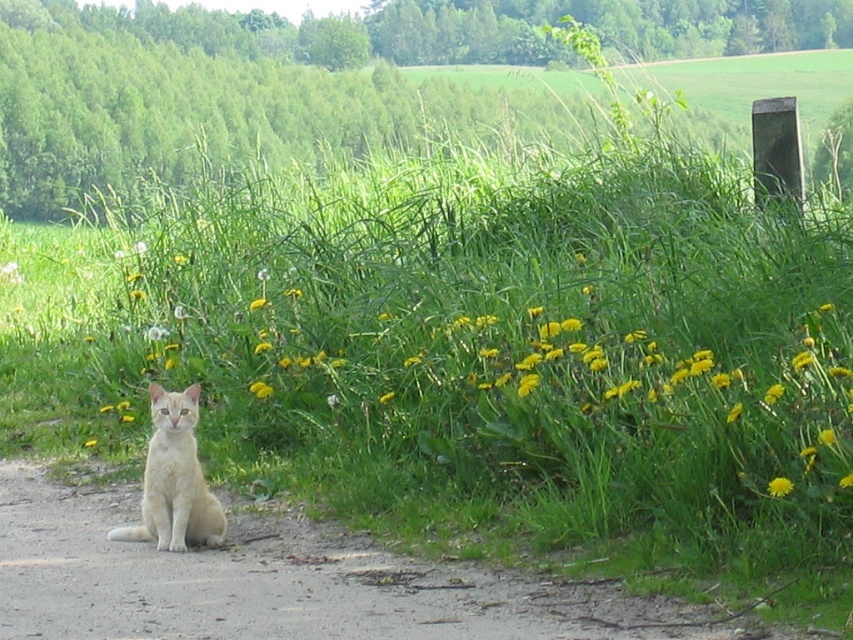
Based on the photo, between brown dirt track at lower left and light beige fur cat at lower left, which one has more height?

light beige fur cat at lower left

Is point (289, 611) behind point (167, 484)?

No, (289, 611) is in front of (167, 484).

Between point (146, 636) and point (194, 401), which one is positioned behind?

The point (194, 401) is behind.

This screenshot has width=853, height=640. I want to click on brown dirt track at lower left, so click(274, 582).

Does yellow matte flower at lower right have a lesser width compared to yellow matte flower at center?

Yes, yellow matte flower at lower right is thinner than yellow matte flower at center.

Can you confirm if yellow matte flower at lower right is positioned above yellow matte flower at center?

Actually, yellow matte flower at lower right is below yellow matte flower at center.

Identify the location of yellow matte flower at lower right. The height and width of the screenshot is (640, 853). (779, 486).

Does light beige fur cat at lower left have a smaller size compared to yellow matte flower at lower right?

No, light beige fur cat at lower left is not smaller than yellow matte flower at lower right.

In the scene shown: Is light beige fur cat at lower left shorter than yellow matte flower at lower right?

In fact, light beige fur cat at lower left may be taller than yellow matte flower at lower right.

Who is more forward, (141, 529) or (770, 484)?

Point (770, 484) is more forward.

At what (x,y) coordinates should I click in order to perform the action: click on light beige fur cat at lower left. Please return your answer as a coordinate pair (x, y). Looking at the image, I should click on (173, 480).